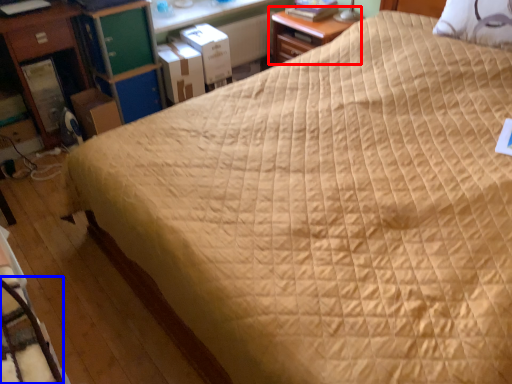
Question: Which point is further to the camera, nightstand (highlighted by a red box) or rocking chair (highlighted by a blue box)?

Choices:
 (A) nightstand
 (B) rocking chair

Answer: (A)